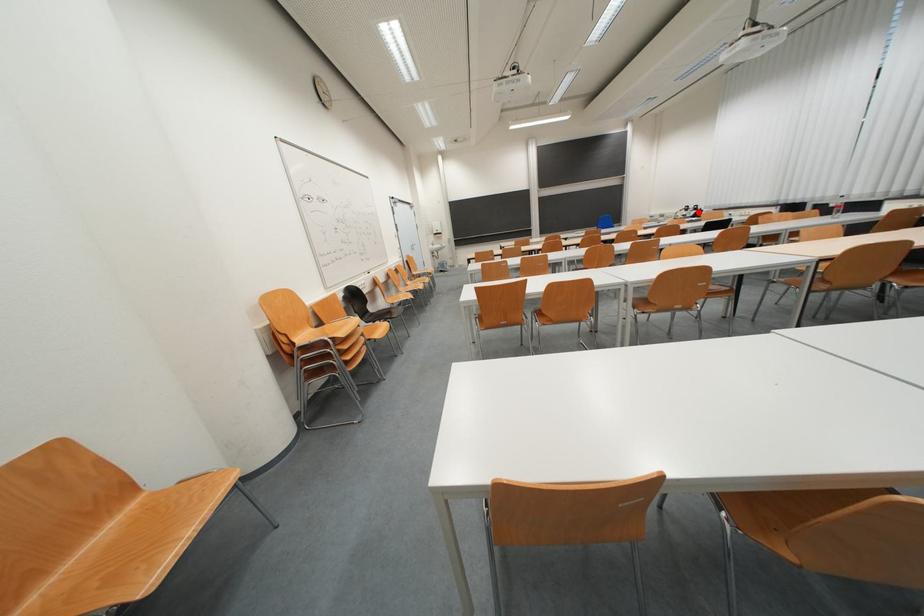
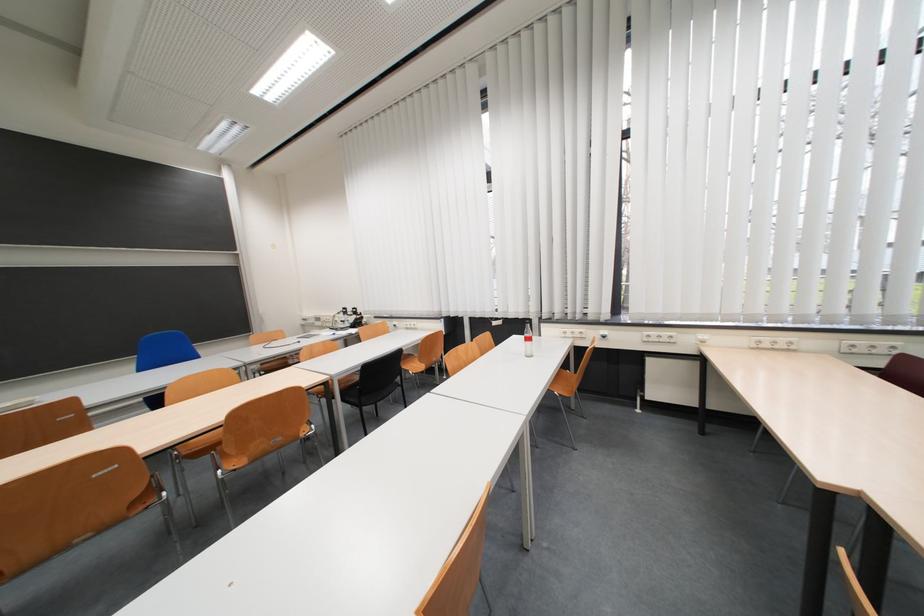
Find the pixel in the second image that matches the highlighted location in the first image.

(357, 315)